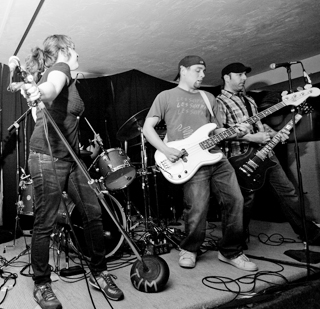
At what (x,y) coordinates should I click in order to perform the action: click on stage. Please return your answer as a coordinate pair (x, y). Image resolution: width=320 pixels, height=309 pixels. Looking at the image, I should click on (186, 296).